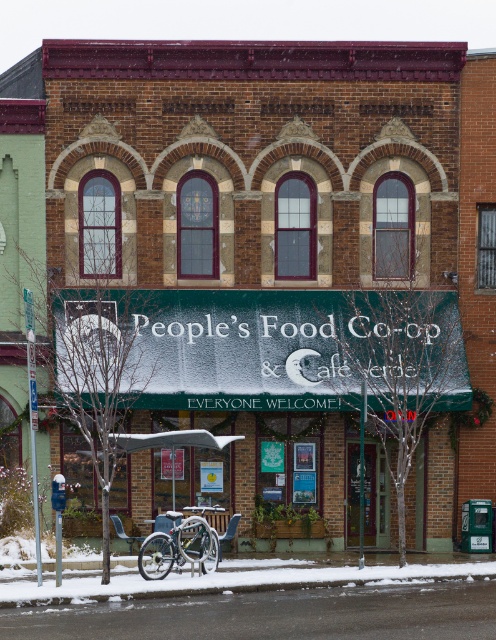
Which is more to the right, white powdery snow at lower center or silver metallic bicycle at lower center?

white powdery snow at lower center is more to the right.

Who is more forward, (5, 584) or (188, 560)?

Positioned in front is point (5, 584).

Locate an element on the screen. Image resolution: width=496 pixels, height=640 pixels. white powdery snow at lower center is located at coordinates pyautogui.click(x=236, y=580).